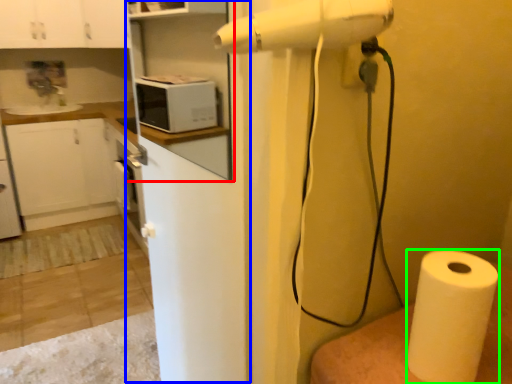
Question: Which is farther away from shelf (highlighted by a red box)? screen door (highlighted by a blue box) or paper towel (highlighted by a green box)?

Choices:
 (A) screen door
 (B) paper towel

Answer: (B)